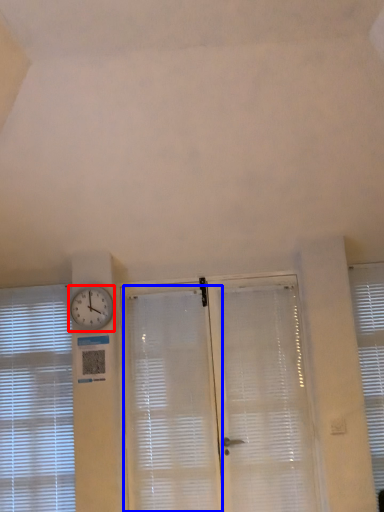
Question: Among these objects, which one is farthest to the camera, clock (highlighted by a red box) or shutter (highlighted by a blue box)?

Choices:
 (A) clock
 (B) shutter

Answer: (A)